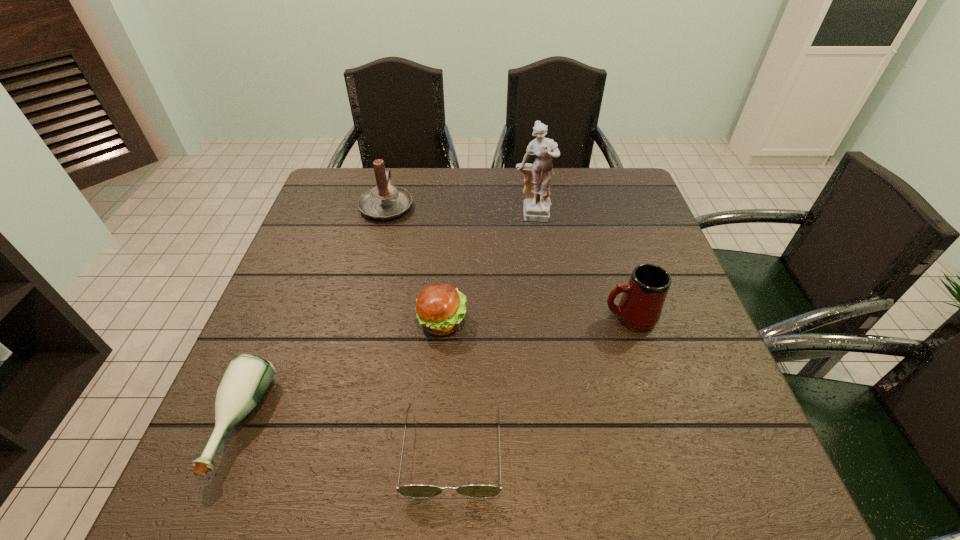
At what (x,y) coordinates should I click in order to perform the action: click on free space at the right edge of the desktop. Please return your answer as a coordinate pair (x, y). The image size is (960, 540). Looking at the image, I should click on [x=653, y=413].

Identify the location of free space at the far right corner of the desktop. (608, 187).

I want to click on vacant space that is in between the rightmost object and the shortest object, so point(540,384).

This screenshot has width=960, height=540. Identify the location of unoccupied area between the figurine and the shortest object. (492, 334).

Locate an element on the screen. Image resolution: width=960 pixels, height=540 pixels. unoccupied position between the sunglasses and the hamburger is located at coordinates (447, 386).

You are a GUI agent. You are given a task and a screenshot of the screen. Output one action in this format:
    pyautogui.click(x=<x>, y=<y>)
    Task: Click on the free spot between the second object from left to right and the sunglasses
    The width and height of the screenshot is (960, 540).
    Given the screenshot: What is the action you would take?
    pyautogui.click(x=420, y=328)

In order to click on vacant area that lies between the leftmost object and the second object from right to left in this screenshot , I will do `click(387, 321)`.

This screenshot has width=960, height=540. I want to click on free space between the shortest object and the leftmost object, so click(347, 437).

Identify the location of empty space between the mug and the second tallest object. The height and width of the screenshot is (540, 960). (508, 261).

Locate an element on the screen. This screenshot has width=960, height=540. vacant area between the leftmost object and the mug is located at coordinates (435, 371).